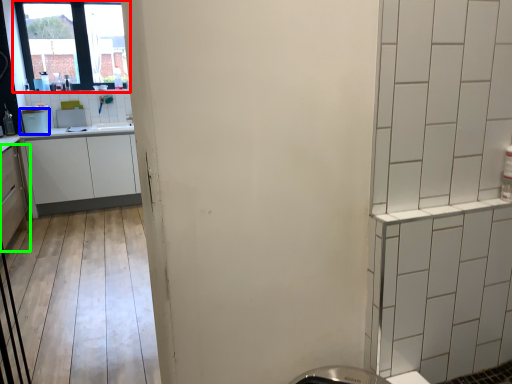
Question: Which object is positioned closest to window (highlighted by a red box)? Select from appliance (highlighted by a blue box) and cabinetry (highlighted by a green box).

Choices:
 (A) appliance
 (B) cabinetry

Answer: (A)